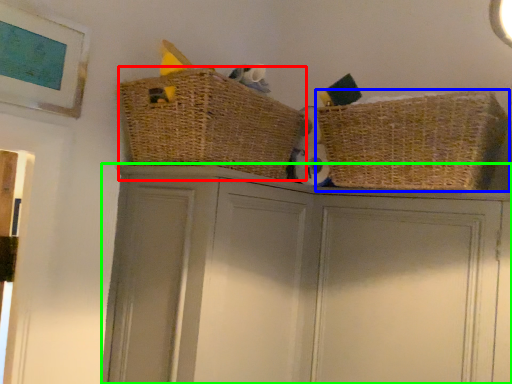
Question: Based on their relative distances, which object is nearer to basket (highlighted by a red box)? Choose from basket (highlighted by a blue box) and cupboard (highlighted by a green box).

Choices:
 (A) basket
 (B) cupboard

Answer: (B)